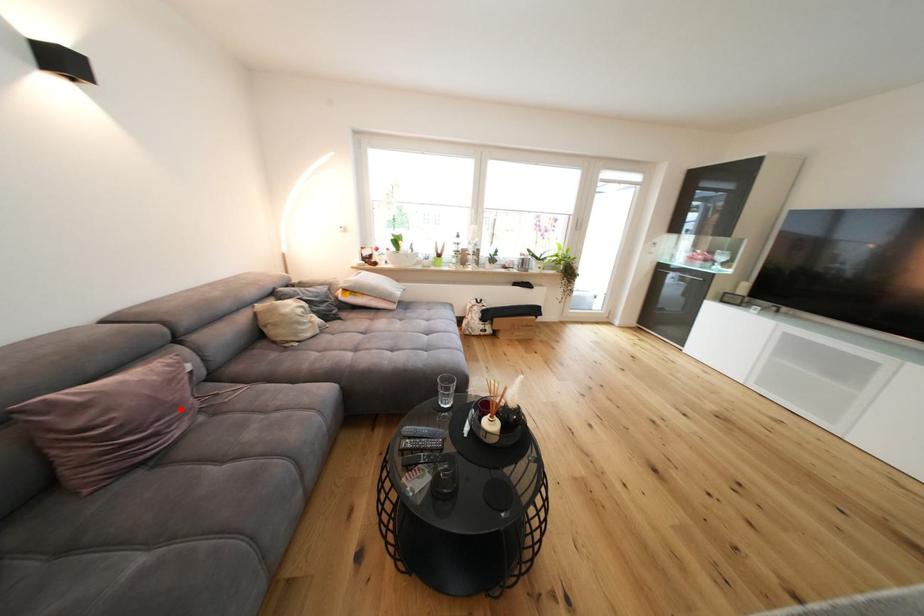
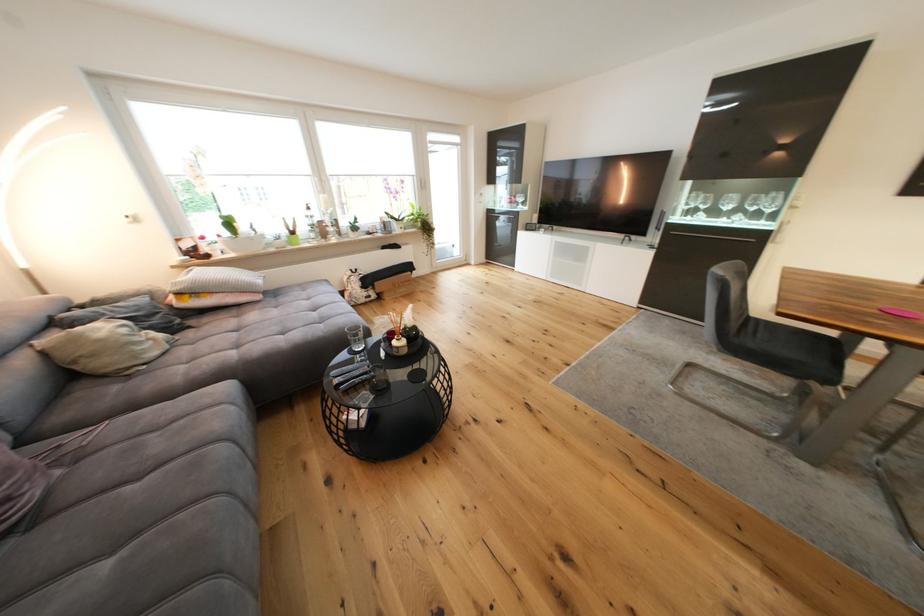
Question: I am providing you with two images of the same scene from different viewpoints. In image1, a red point is highlighted. Considering the same 3D point in image2, which of the following is correct?

Choices:
 (A) It is closer
 (B) It is farther

Answer: (B)